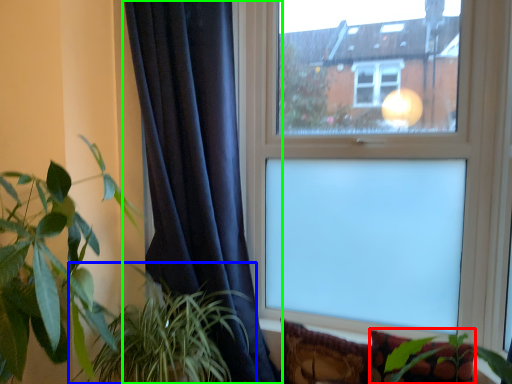
Question: Estimate the real-world distances between objects in this image. Which object is farther from pillow (highlighted by a red box), houseplant (highlighted by a blue box) or curtain (highlighted by a green box)?

Choices:
 (A) houseplant
 (B) curtain

Answer: (B)